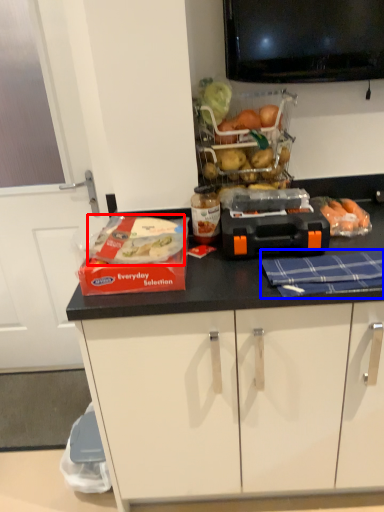
Question: Among these objects, which one is nearest to the camera, food (highlighted by a red box) or blanket (highlighted by a blue box)?

Choices:
 (A) food
 (B) blanket

Answer: (B)